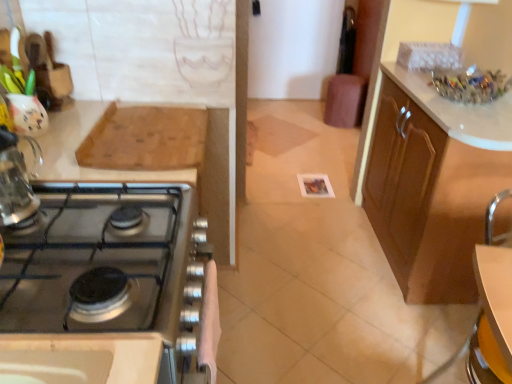
I want to click on free location to the right of clear glass kettle at left, so click(x=101, y=194).